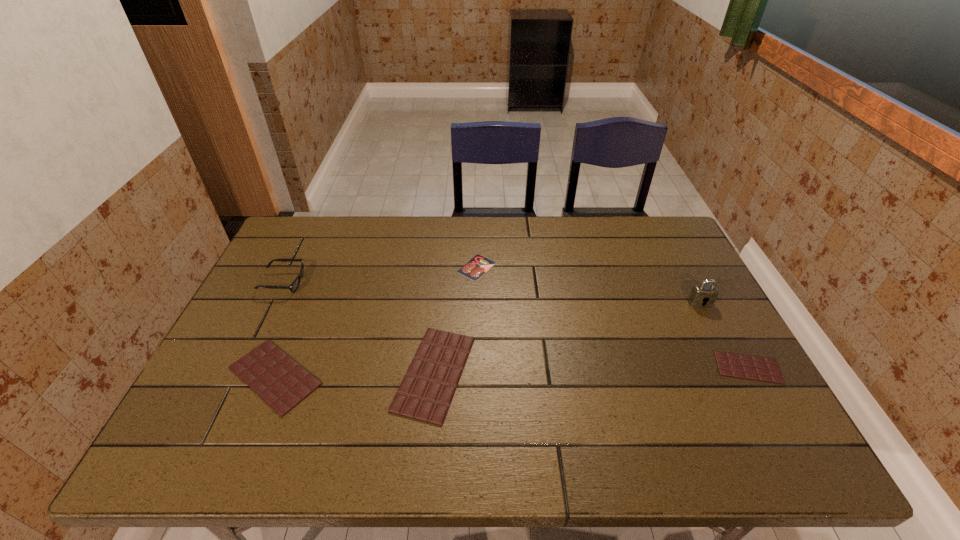
Identify the location of vacant space in between the second chocolate bar from right to left and the third farthest object. This screenshot has height=540, width=960. (567, 338).

This screenshot has height=540, width=960. I want to click on free space between the shortest chocolate bar and the second tallest chocolate bar, so click(x=512, y=372).

The height and width of the screenshot is (540, 960). What are the coordinates of `free space between the leftmost chocolate bar and the sunglasses` in the screenshot? It's located at (279, 329).

At what (x,y) coordinates should I click in order to perform the action: click on free space between the second chocolate bar from left to right and the sunglasses. Please return your answer as a coordinate pair (x, y). The width and height of the screenshot is (960, 540). Looking at the image, I should click on (359, 328).

Find the location of a particular element. The width and height of the screenshot is (960, 540). free area in between the shortest object and the shortest chocolate bar is located at coordinates (612, 318).

Where is `vacant area between the shortest object and the fourth tallest object`? vacant area between the shortest object and the fourth tallest object is located at coordinates (375, 321).

Identify the location of unoccupied area between the shortest object and the second tallest chocolate bar. The width and height of the screenshot is (960, 540). (375, 321).

What are the coordinates of `vacant area between the second chocolate bar from right to left and the shortest object` in the screenshot? It's located at (x=455, y=320).

Where is `object that can be found as the closest to the shortest object`? This screenshot has width=960, height=540. object that can be found as the closest to the shortest object is located at coordinates (426, 391).

Locate an element on the screen. the fourth closest object relative to the second tallest object is located at coordinates (700, 294).